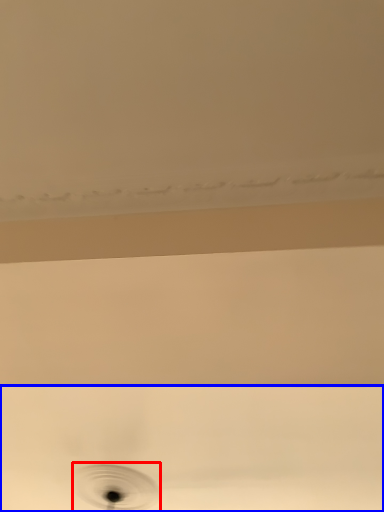
Question: Which point is further to the camera, hole (highlighted by a red box) or plumbing fixture (highlighted by a blue box)?

Choices:
 (A) hole
 (B) plumbing fixture

Answer: (A)